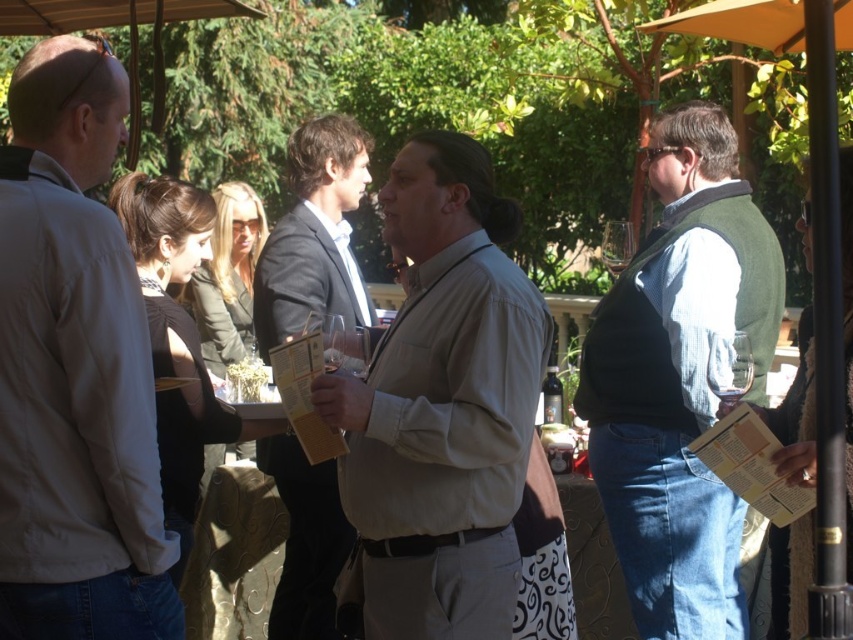
Question: Does denim vest at right appear under dark brown suit at center?

Choices:
 (A) yes
 (B) no

Answer: (A)

Question: Can you confirm if light beige shirt at left is positioned above denim vest at right?

Choices:
 (A) yes
 (B) no

Answer: (A)

Question: Is light beige shirt at left wider than dark brown suit at center?

Choices:
 (A) yes
 (B) no

Answer: (B)

Question: Which object is farther from the camera taking this photo?

Choices:
 (A) denim vest at right
 (B) light beige shirt at left
 (C) light beige shirt at center

Answer: (A)

Question: Which object appears farthest from the camera in this image?

Choices:
 (A) dark brown suit at center
 (B) light beige shirt at center

Answer: (A)

Question: Which point is closer to the camera taking this photo?

Choices:
 (A) (136, 353)
 (B) (701, 120)

Answer: (A)